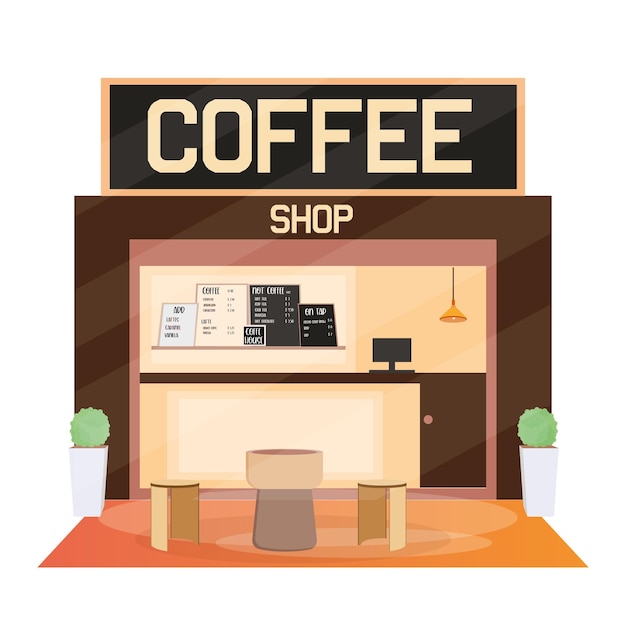
Locate an element on the screen. The image size is (626, 626). green plants is located at coordinates (526, 429), (88, 429).